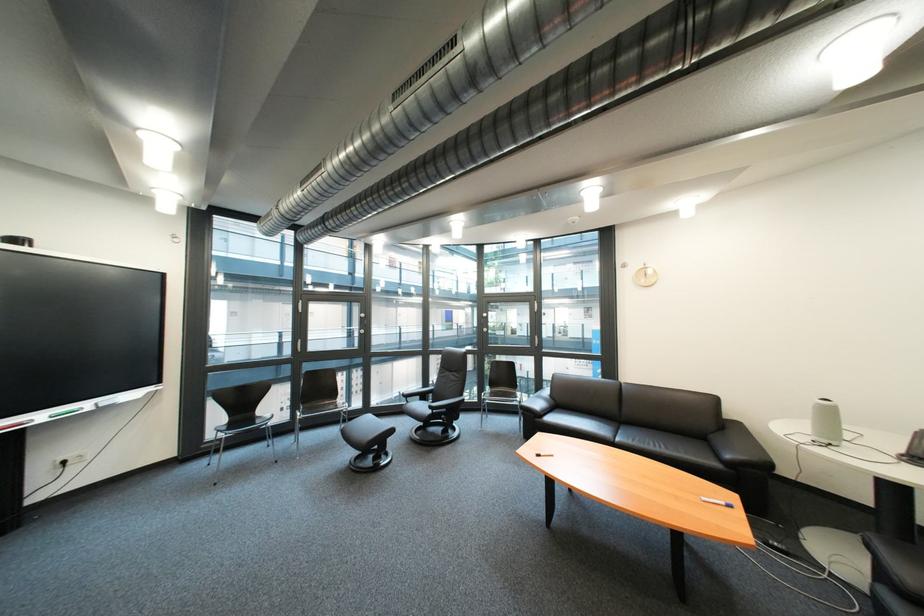
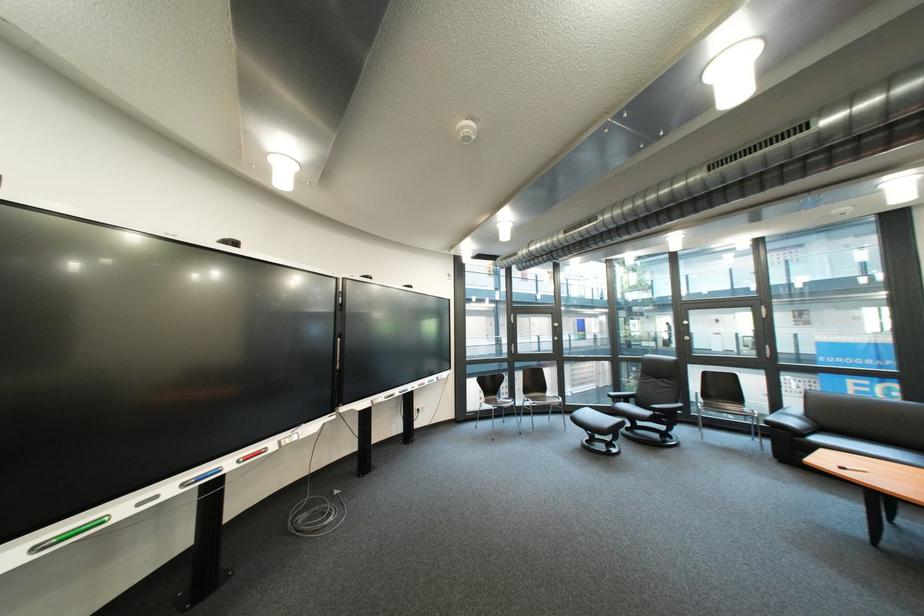
Looking at this image, the images are taken continuously from a first-person perspective. In which direction are you moving?

The movement direction of the cameraman is left, backward.